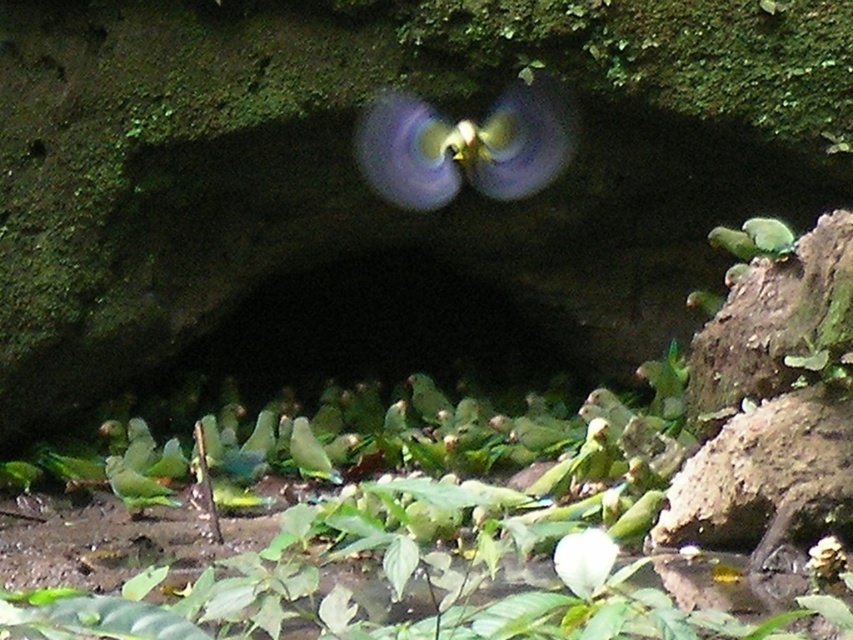
Which is above, green leafy plant at center or blurred green parrot at center?

Positioned higher is blurred green parrot at center.

Can you confirm if green leafy plant at center is positioned to the right of blurred green parrot at center?

In fact, green leafy plant at center is to the left of blurred green parrot at center.

Does point (306, 468) come closer to viewer compared to point (415, 160)?

Yes, it is.

Locate an element on the screen. The width and height of the screenshot is (853, 640). green leafy plant at center is located at coordinates (431, 531).